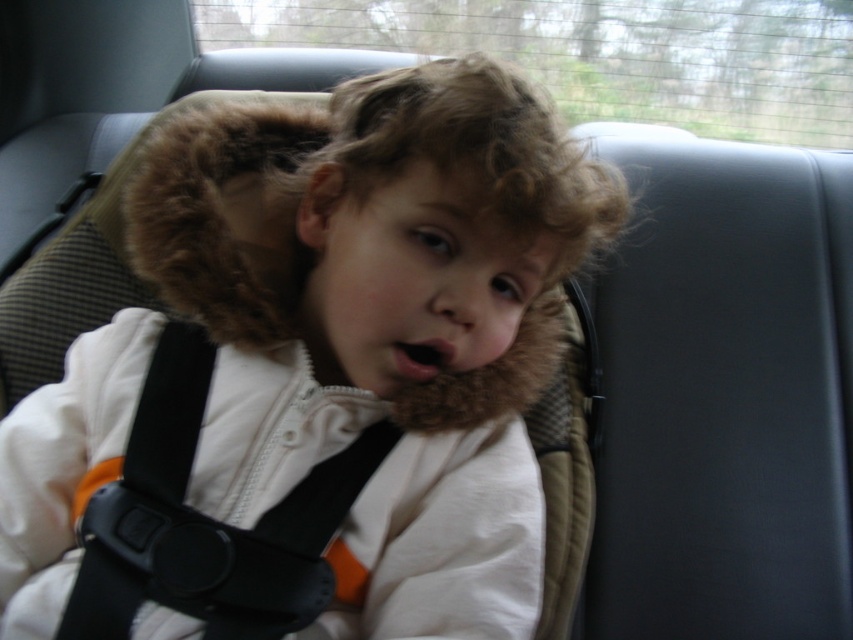
You are a safety inspector checking the car seat setup. You notice the white fleece jacket at center and the black plastic seatbelt at center. According to safety guidelines, the seatbelt should be positioned closer to the child than the jacket. Is the current setup compliant?

The white fleece jacket at center is closer to the viewer than the black plastic seatbelt at center. This means the seatbelt is not positioned close to the child as required, so the setup is not compliant with safety guidelines.

You are a safety inspector checking the car seat setup. The child is wearing a white fleece jacket at center and secured by a black plastic seatbelt at center. According to safety guidelines, the seatbelt should fit snugly without any excess material between the child and the seatbelt. Does the current setup comply with safety standards?

The white fleece jacket at center is wider than the black plastic seatbelt at center, which means there might be excess material between the child and the seatbelt. This could compromise safety, so the setup does not comply with safety standards.

You are a safety inspector checking the car seat setup. You notice the white fleece jacket at center and the black plastic seatbelt at center. According to safety guidelines, the seatbelt should be positioned at the same height as the child. Does the current setup comply with safety standards?

The white fleece jacket at center is taller than the black plastic seatbelt at center, meaning the seatbelt is positioned too low. This does not comply with safety standards as the seatbelt should be at the same height as the child.